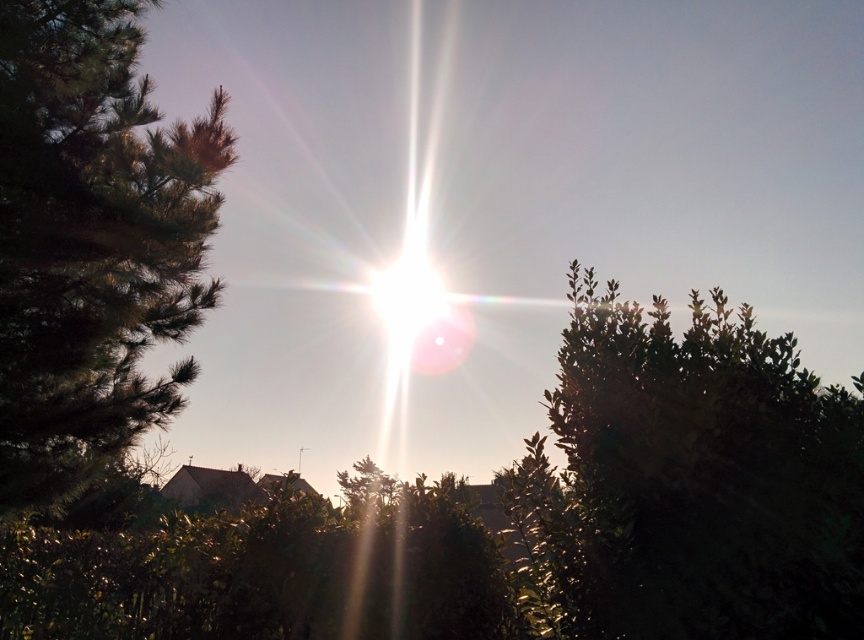
Between point (558, 576) and point (72, 253), which one is positioned behind?

Positioned behind is point (72, 253).

Between point (619, 513) and point (37, 355), which one is positioned in front?

Point (619, 513) is in front.

Image resolution: width=864 pixels, height=640 pixels. What do you see at coordinates (694, 481) in the screenshot?
I see `green leafy bush at upper right` at bounding box center [694, 481].

Identify the location of green leafy bush at upper right. This screenshot has height=640, width=864. (694, 481).